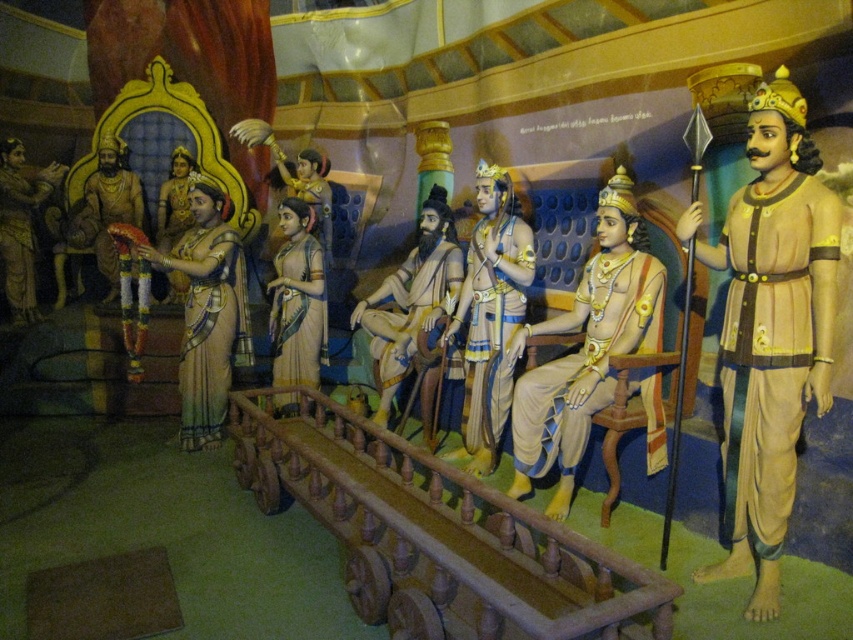
Question: Among these points, which one is nearest to the camera?

Choices:
 (A) (799, 426)
 (B) (198, 317)

Answer: (A)

Question: Is wooden rail at center below matte gold jewelry at center?

Choices:
 (A) yes
 (B) no

Answer: (A)

Question: Which point appears farthest from the camera in this image?

Choices:
 (A) (403, 369)
 (B) (773, 504)

Answer: (A)

Question: Can you confirm if matte gold statue at center is positioned below matte gold crown at left?

Choices:
 (A) yes
 (B) no

Answer: (A)

Question: Is wooden rail at center to the left of smooth beige robe at center from the viewer's perspective?

Choices:
 (A) yes
 (B) no

Answer: (B)

Question: Which object appears farthest from the camera in this image?

Choices:
 (A) wooden rail at center
 (B) golden textured robe at right
 (C) matte gold crown at left

Answer: (C)